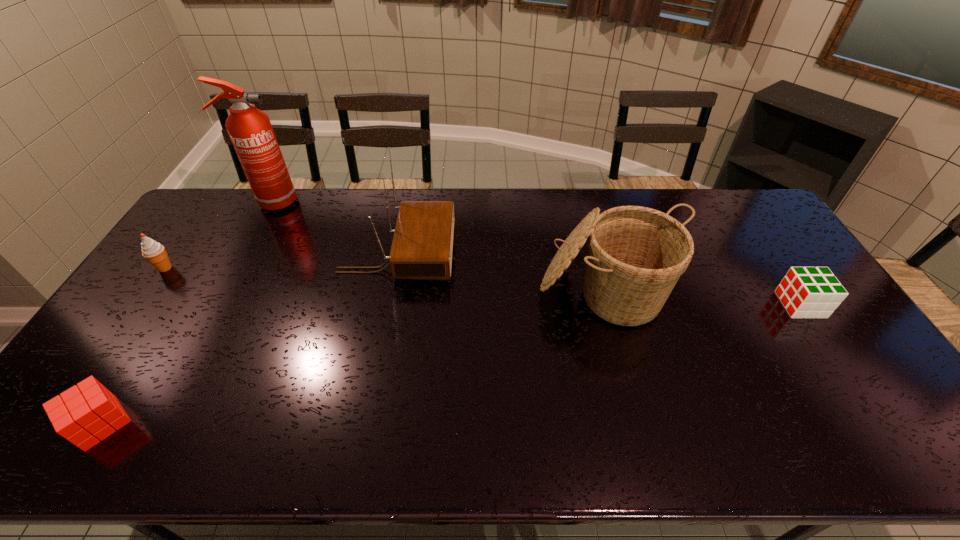
The width and height of the screenshot is (960, 540). I want to click on object located in the near edge section of the desktop, so click(x=84, y=415).

The image size is (960, 540). I want to click on fire extinguisher at the left edge, so click(x=250, y=130).

At what (x,y) coordinates should I click in order to perform the action: click on icecream that is positioned at the left edge. Please return your answer as a coordinate pair (x, y). This screenshot has height=540, width=960. Looking at the image, I should click on (154, 252).

Where is `cube that is at the left edge`? cube that is at the left edge is located at coordinates (84, 415).

The width and height of the screenshot is (960, 540). In order to click on object that is at the right edge in this screenshot , I will do `click(806, 292)`.

Find the location of a particular element. This screenshot has width=960, height=540. object that is positioned at the far left corner is located at coordinates (250, 130).

The height and width of the screenshot is (540, 960). I want to click on object that is at the near left corner, so click(84, 415).

Find the location of a particular element. vacant space at the far edge of the desktop is located at coordinates (690, 204).

Identify the location of free region at the near edge of the desktop. coord(471,444).

Identify the location of vacant area at the left edge of the desktop. The width and height of the screenshot is (960, 540). (106, 366).